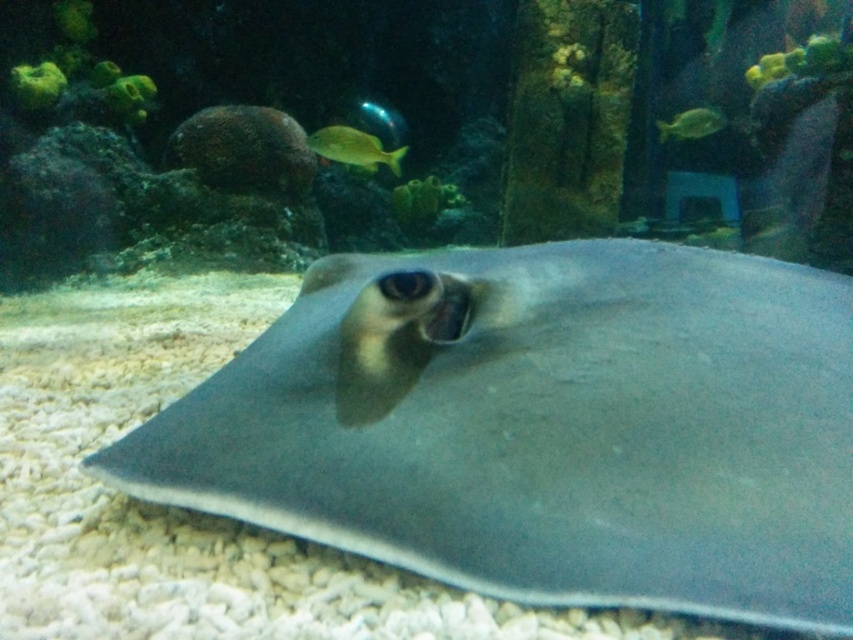
You are an underwater photographer trying to capture the smooth gray stingray at center and the yellow matte fish at upper center in the same frame. Based on their sizes, which one should you focus on to ensure both fit in the photo?

The smooth gray stingray at center is taller than the yellow matte fish at upper center, so focusing on the stingray will ensure both fit in the photo since it is larger and can accommodate the smaller fish within the frame.

Consider the image. You are a marine biologist observing an underwater scene in an aquarium. You notice a point marked at coordinates (x=543, y=426). What object is located at this point?

The point at coordinates (x=543, y=426) indicates the smooth gray stingray at center.

You are an underwater explorer observing the scene. There is a point at coordinates point (352, 147). What object is located at this point?

The yellow matte fish at upper center is located at point (352, 147).